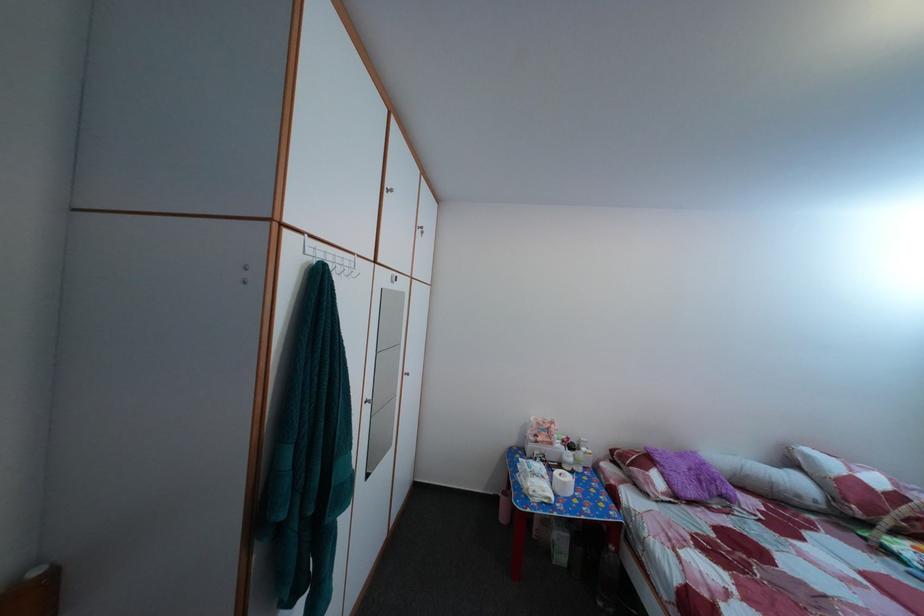
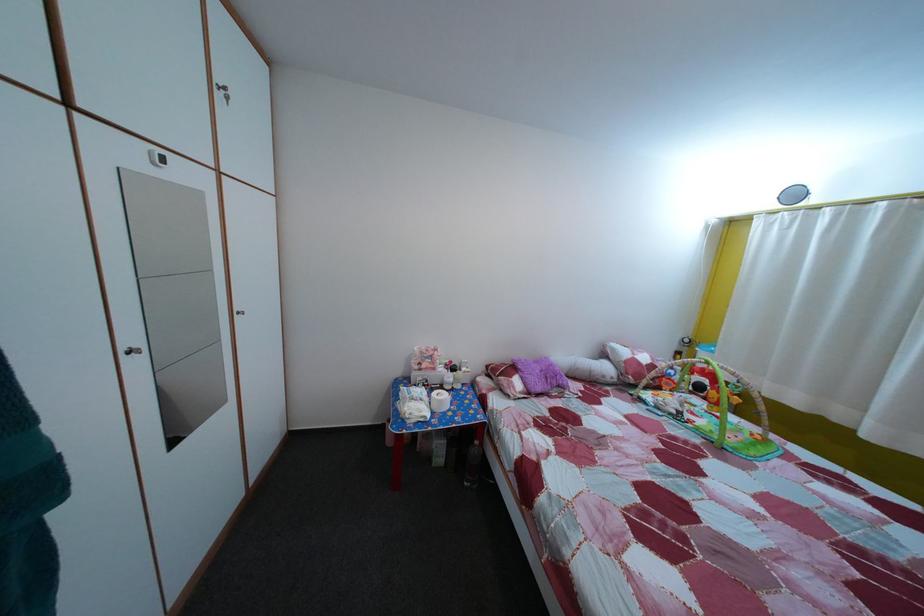
Question: How did the camera likely rotate?

Choices:
 (A) Left
 (B) Right
 (C) Up
 (D) Down

Answer: (B)